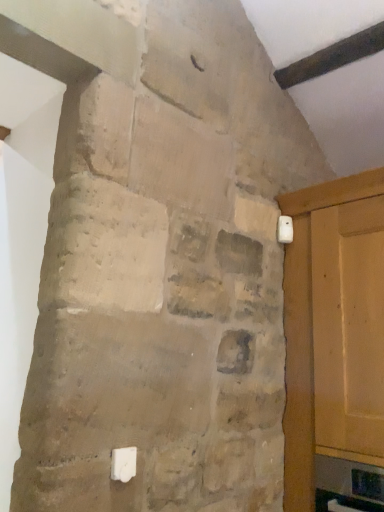
The image size is (384, 512). What do you see at coordinates (123, 464) in the screenshot?
I see `white plastic light switch at lower center, arranged as the 1th light switch when viewed from the left` at bounding box center [123, 464].

Where is `white plastic light switch at upper right, the 2th light switch in the left-to-right sequence`? Image resolution: width=384 pixels, height=512 pixels. white plastic light switch at upper right, the 2th light switch in the left-to-right sequence is located at coordinates (285, 229).

This screenshot has width=384, height=512. I want to click on white plastic light switch at lower center, the second light switch in the right-to-left sequence, so click(x=123, y=464).

From a real-world perspective, between white plastic light switch at upper right, which is the 1th light switch in back-to-front order, and white plastic light switch at lower center, the second light switch in the right-to-left sequence, who is vertically lower?

white plastic light switch at lower center, the second light switch in the right-to-left sequence.

Can you confirm if white plastic light switch at upper right, the 2th light switch in the left-to-right sequence, is bigger than white plastic light switch at lower center, the second light switch when ordered from top to bottom?

Yes.

Where is `light switch lying behind the white plastic light switch at lower center, the 1th light switch in the front-to-back sequence`? light switch lying behind the white plastic light switch at lower center, the 1th light switch in the front-to-back sequence is located at coordinates 285,229.

How different are the orientations of white plastic light switch at lower center, the first light switch in the bottom-to-top sequence, and matte wood door at right in degrees?

The angle between the facing direction of white plastic light switch at lower center, the first light switch in the bottom-to-top sequence, and the facing direction of matte wood door at right is 88.9 degrees.

From the image's perspective, which object appears higher, white plastic light switch at lower center, the first light switch in the bottom-to-top sequence, or matte wood door at right?

matte wood door at right.

In the image, is white plastic light switch at lower center, the 1th light switch in the front-to-back sequence, on the left side or the right side of matte wood door at right?

Clearly, white plastic light switch at lower center, the 1th light switch in the front-to-back sequence, is on the left of matte wood door at right in the image.

Is white plastic light switch at lower center, arranged as the 1th light switch when viewed from the left, looking in the opposite direction of matte wood door at right?

No, matte wood door at right is not at the back of white plastic light switch at lower center, arranged as the 1th light switch when viewed from the left.

Is matte wood door at right facing away from white plastic light switch at lower center, the second light switch when ordered from top to bottom?

No, matte wood door at right is not facing the opposite direction of white plastic light switch at lower center, the second light switch when ordered from top to bottom.

Is matte wood door at right located outside white plastic light switch at lower center, the first light switch in the bottom-to-top sequence?

matte wood door at right is positioned outside white plastic light switch at lower center, the first light switch in the bottom-to-top sequence.

Considering the positions of point (344, 183) and point (119, 450), is point (344, 183) closer or farther from the camera than point (119, 450)?

Point (344, 183) is farther from the camera than point (119, 450).

Looking at this image, considering the sizes of matte wood door at right and white plastic light switch at lower center, arranged as the 1th light switch when viewed from the left, in the image, is matte wood door at right wider or thinner than white plastic light switch at lower center, arranged as the 1th light switch when viewed from the left,?

In the image, matte wood door at right appears to be wider than white plastic light switch at lower center, arranged as the 1th light switch when viewed from the left.

Can you see matte wood door at right touching white plastic light switch at upper right, which is the 1th light switch in back-to-front order?

No, matte wood door at right is not touching white plastic light switch at upper right, which is the 1th light switch in back-to-front order.

Between matte wood door at right and white plastic light switch at upper right, acting as the 2th light switch starting from the front, which one has larger width?

Wider between the two is matte wood door at right.

Consider the image. Is matte wood door at right to the right of white plastic light switch at upper right, acting as the 2th light switch starting from the front, from the viewer's perspective?

Yes, matte wood door at right is to the right of white plastic light switch at upper right, acting as the 2th light switch starting from the front.

Is matte wood door at right oriented away from white plastic light switch at upper right, positioned as the first light switch in right-to-left order?

matte wood door at right is not turned away from white plastic light switch at upper right, positioned as the first light switch in right-to-left order.

Is white plastic light switch at lower center, the second light switch when ordered from top to bottom, taller than white plastic light switch at upper right, the 2th light switch in the left-to-right sequence?

Incorrect, the height of white plastic light switch at lower center, the second light switch when ordered from top to bottom, is not larger of that of white plastic light switch at upper right, the 2th light switch in the left-to-right sequence.

Considering the positions of objects white plastic light switch at lower center, the second light switch when ordered from top to bottom, and white plastic light switch at upper right, the 2th light switch positioned from the bottom, in the image provided, who is more to the left, white plastic light switch at lower center, the second light switch when ordered from top to bottom, or white plastic light switch at upper right, the 2th light switch positioned from the bottom,?

white plastic light switch at lower center, the second light switch when ordered from top to bottom, is more to the left.

Based on the photo, is white plastic light switch at lower center, arranged as the 1th light switch when viewed from the left, turned away from white plastic light switch at upper right, the 1th light switch in the top-to-bottom sequence?

No, white plastic light switch at upper right, the 1th light switch in the top-to-bottom sequence, is not at the back of white plastic light switch at lower center, arranged as the 1th light switch when viewed from the left.

Considering their positions, is white plastic light switch at lower center, the first light switch in the bottom-to-top sequence, located in front of or behind white plastic light switch at upper right, positioned as the first light switch in right-to-left order?

white plastic light switch at lower center, the first light switch in the bottom-to-top sequence, is positioned closer to the viewer than white plastic light switch at upper right, positioned as the first light switch in right-to-left order.

Is the surface of white plastic light switch at upper right, the 2th light switch in the left-to-right sequence, in direct contact with matte wood door at right?

No.

How different are the orientations of white plastic light switch at upper right, the 2th light switch in the left-to-right sequence, and matte wood door at right in degrees?

There is a 88.9-degree angle between the facing directions of white plastic light switch at upper right, the 2th light switch in the left-to-right sequence, and matte wood door at right.

Considering the sizes of white plastic light switch at upper right, acting as the 2th light switch starting from the front, and matte wood door at right in the image, is white plastic light switch at upper right, acting as the 2th light switch starting from the front, wider or thinner than matte wood door at right?

Clearly, white plastic light switch at upper right, acting as the 2th light switch starting from the front, has less width compared to matte wood door at right.

From a real-world perspective, which is physically below, white plastic light switch at upper right, the 1th light switch in the top-to-bottom sequence, or matte wood door at right?

matte wood door at right.

Find the location of a particular element. Image resolution: width=384 pixels, height=512 pixels. light switch directly beneath the white plastic light switch at upper right, the 1th light switch in the top-to-bottom sequence (from a real-world perspective) is located at coordinates (123, 464).

The image size is (384, 512). What are the coordinates of `door located above the white plastic light switch at lower center, arranged as the 1th light switch when viewed from the left (from the image's perspective)` in the screenshot? It's located at (307, 327).

When comparing their distances from matte wood door at right, does white plastic light switch at upper right, which is the 1th light switch in back-to-front order, or white plastic light switch at lower center, the 1th light switch in the front-to-back sequence, seem closer?

Among the two, white plastic light switch at upper right, which is the 1th light switch in back-to-front order, is located nearer to matte wood door at right.

Considering their positions, is white plastic light switch at lower center, the 2th light switch from the back, positioned further to matte wood door at right than white plastic light switch at upper right, the 2th light switch in the left-to-right sequence?

The object further to matte wood door at right is white plastic light switch at lower center, the 2th light switch from the back.

Based on their spatial positions, is matte wood door at right or white plastic light switch at upper right, positioned as the first light switch in right-to-left order, closer to white plastic light switch at lower center, the first light switch in the bottom-to-top sequence?

The object closer to white plastic light switch at lower center, the first light switch in the bottom-to-top sequence, is matte wood door at right.

Looking at the image, which one is located further to white plastic light switch at upper right, positioned as the first light switch in right-to-left order, matte wood door at right or white plastic light switch at lower center, the 1th light switch in the front-to-back sequence?

white plastic light switch at lower center, the 1th light switch in the front-to-back sequence, lies further to white plastic light switch at upper right, positioned as the first light switch in right-to-left order, than the other object.

Based on their spatial positions, is white plastic light switch at upper right, positioned as the first light switch in right-to-left order, or matte wood door at right closer to white plastic light switch at lower center, the 2th light switch from the back?

The object closer to white plastic light switch at lower center, the 2th light switch from the back, is matte wood door at right.

From the image, which object appears to be farther from white plastic light switch at upper right, which is the 1th light switch in back-to-front order, white plastic light switch at lower center, the first light switch in the bottom-to-top sequence, or matte wood door at right?

The object further to white plastic light switch at upper right, which is the 1th light switch in back-to-front order, is white plastic light switch at lower center, the first light switch in the bottom-to-top sequence.

Where is `light switch between white plastic light switch at lower center, the second light switch when ordered from top to bottom, and matte wood door at right, in the horizontal direction`? The height and width of the screenshot is (512, 384). light switch between white plastic light switch at lower center, the second light switch when ordered from top to bottom, and matte wood door at right, in the horizontal direction is located at coordinates (285, 229).